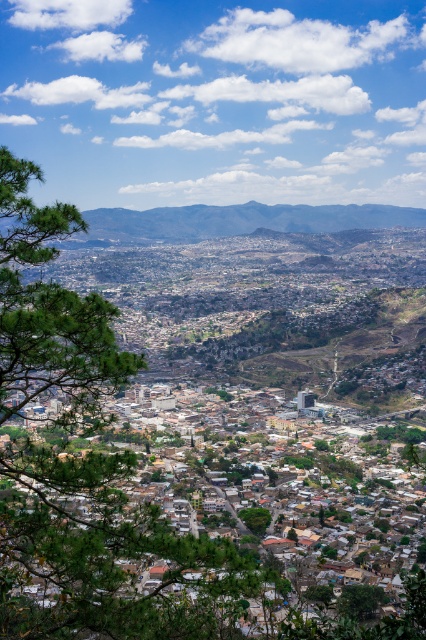
Does green leafy tree at left appear on the left side of green leafy tree at center?

Indeed, green leafy tree at left is positioned on the left side of green leafy tree at center.

Who is taller, green leafy tree at left or green leafy tree at center?

green leafy tree at left is taller.

This screenshot has height=640, width=426. Describe the element at coordinates (85, 467) in the screenshot. I see `green leafy tree at left` at that location.

Locate an element on the screen. Image resolution: width=426 pixels, height=640 pixels. green leafy tree at left is located at coordinates (85, 467).

Between green leafy tree at left and green leafy tree at lower right, which one appears on the right side from the viewer's perspective?

green leafy tree at lower right

Can you confirm if green leafy tree at left is positioned to the left of green leafy tree at lower right?

Yes, green leafy tree at left is to the left of green leafy tree at lower right.

What are the coordinates of `green leafy tree at left` in the screenshot? It's located at (85, 467).

Is green leafy tree at lower right wider than green leafy tree at center?

Yes, green leafy tree at lower right is wider than green leafy tree at center.

I want to click on green leafy tree at lower right, so click(x=359, y=600).

Is point (374, 595) closer to viewer compared to point (255, 531)?

Yes, it is.

You are a GUI agent. You are given a task and a screenshot of the screen. Output one action in this format:
    pyautogui.click(x=<x>, y=<y>)
    Task: Click on the green leafy tree at lower right
    The image size is (426, 640).
    Given the screenshot: What is the action you would take?
    pyautogui.click(x=359, y=600)